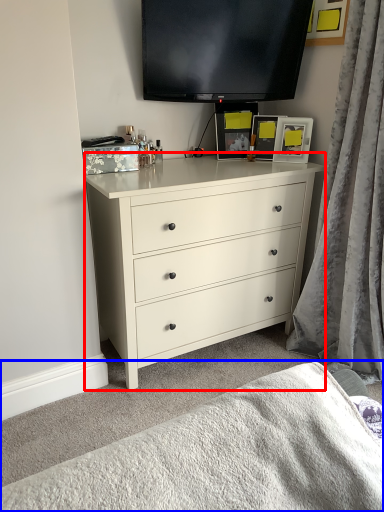
Question: Among these objects, which one is farthest to the camera, chest of drawers (highlighted by a red box) or bedding (highlighted by a blue box)?

Choices:
 (A) chest of drawers
 (B) bedding

Answer: (A)